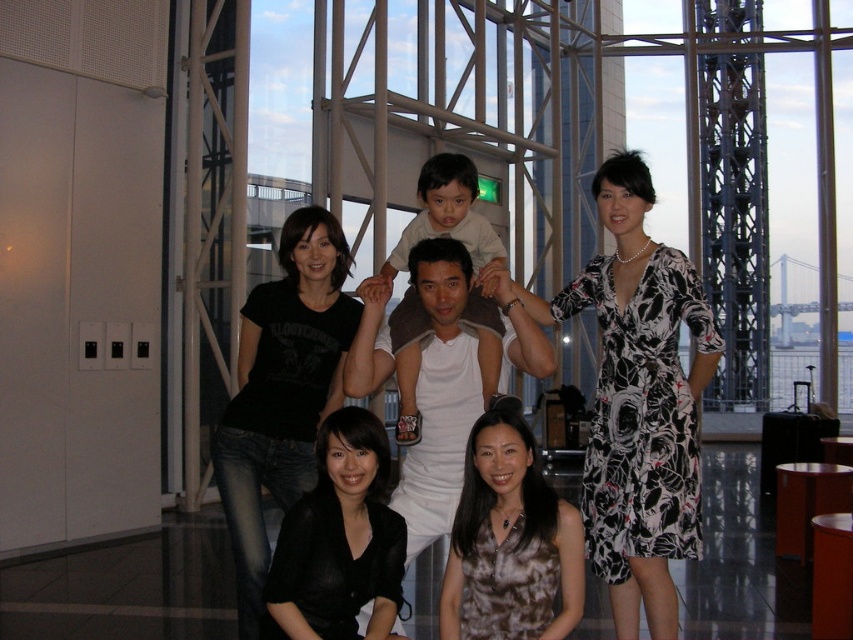
Is point (482, 497) more distant than point (334, 525)?

Yes, point (482, 497) is farther from viewer.

Measure the distance between brown printed dress at lower center and camera.

brown printed dress at lower center and camera are 27.26 meters apart.

Which is behind, point (480, 460) or point (390, 547)?

The point (480, 460) is behind.

Identify the location of brown printed dress at lower center. Image resolution: width=853 pixels, height=640 pixels. (509, 544).

Can you confirm if black cotton t-shirt at center is thinner than black matte shirt at lower center?

No, black cotton t-shirt at center is not thinner than black matte shirt at lower center.

Is point (335, 328) farther from viewer compared to point (325, 544)?

Yes, point (335, 328) is behind point (325, 544).

Does point (334, 388) come behind point (350, 534)?

Yes, point (334, 388) is behind point (350, 534).

Where is `black cotton t-shirt at center`? The height and width of the screenshot is (640, 853). black cotton t-shirt at center is located at coordinates (282, 392).

Is black floral dress at center positioned in front of black cotton t-shirt at center?

No.

Is point (590, 563) more distant than point (250, 461)?

Yes, point (590, 563) is behind point (250, 461).

The width and height of the screenshot is (853, 640). What are the coordinates of `black floral dress at center` in the screenshot? It's located at (641, 412).

This screenshot has width=853, height=640. Identify the location of black floral dress at center. (641, 412).